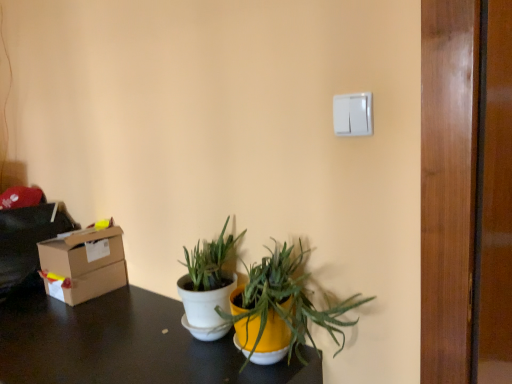
Question: From a real-world perspective, is cardboard box at left on white matte pot at center, the 2th houseplant in the right-to-left sequence?

Choices:
 (A) yes
 (B) no

Answer: (B)

Question: Is cardboard box at left far away from white matte pot at center, the first houseplant when ordered from left to right?

Choices:
 (A) no
 (B) yes

Answer: (A)

Question: From a real-world perspective, is cardboard box at left under white matte pot at center, the first houseplant when ordered from left to right?

Choices:
 (A) no
 (B) yes

Answer: (B)

Question: Is cardboard box at left positioned with its back to white matte pot at center, the 2th houseplant in the right-to-left sequence?

Choices:
 (A) no
 (B) yes

Answer: (A)

Question: Does cardboard box at left come behind white matte pot at center, the first houseplant when ordered from left to right?

Choices:
 (A) yes
 (B) no

Answer: (A)

Question: From a real-world perspective, relative to white plastic light switch at upper right, is matte black desk at lower center vertically above or below?

Choices:
 (A) below
 (B) above

Answer: (A)

Question: Is matte black desk at lower center inside the boundaries of white plastic light switch at upper right, or outside?

Choices:
 (A) outside
 (B) inside

Answer: (A)

Question: Considering the positions of point (80, 344) and point (360, 99), is point (80, 344) closer or farther from the camera than point (360, 99)?

Choices:
 (A) farther
 (B) closer

Answer: (A)

Question: Is matte black desk at lower center bigger or smaller than white plastic light switch at upper right?

Choices:
 (A) big
 (B) small

Answer: (A)

Question: Considering the positions of white matte pot at center, the 2th houseplant in the right-to-left sequence, and cardboard box at left in the image, is white matte pot at center, the 2th houseplant in the right-to-left sequence, wider or thinner than cardboard box at left?

Choices:
 (A) thin
 (B) wide

Answer: (B)

Question: Considering the positions of white matte pot at center, the first houseplant when ordered from left to right, and cardboard box at left in the image, is white matte pot at center, the first houseplant when ordered from left to right, taller or shorter than cardboard box at left?

Choices:
 (A) short
 (B) tall

Answer: (B)

Question: From the image's perspective, is white matte pot at center, the 2th houseplant in the right-to-left sequence, positioned above or below cardboard box at left?

Choices:
 (A) below
 (B) above

Answer: (B)

Question: Looking at the image, does white matte pot at center, the 2th houseplant in the right-to-left sequence, seem bigger or smaller compared to cardboard box at left?

Choices:
 (A) small
 (B) big

Answer: (A)

Question: Is point (196, 269) closer or farther from the camera than point (336, 119)?

Choices:
 (A) farther
 (B) closer

Answer: (A)

Question: From their relative heights in the image, would you say white matte pot at center, the 2th houseplant in the right-to-left sequence, is taller or shorter than white plastic light switch at upper right?

Choices:
 (A) short
 (B) tall

Answer: (B)